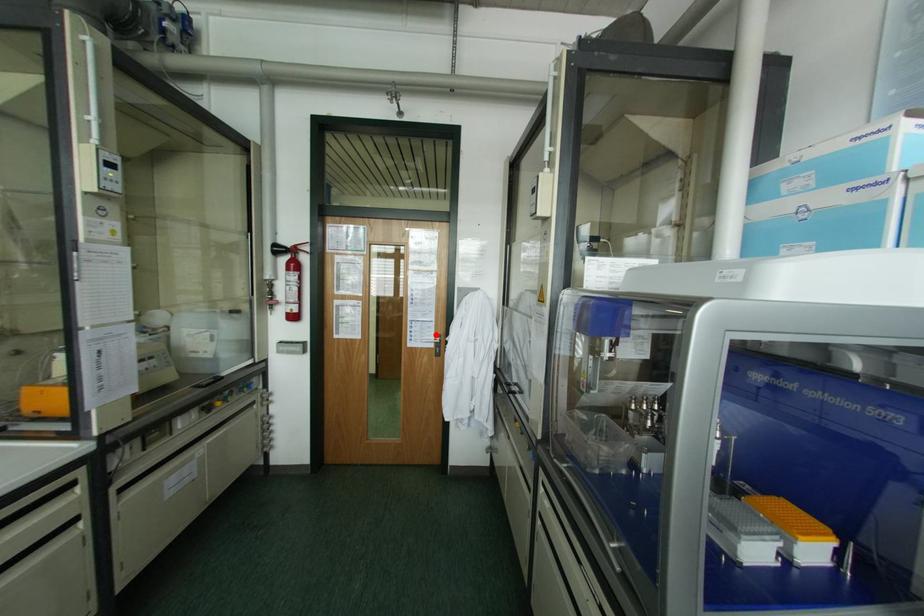
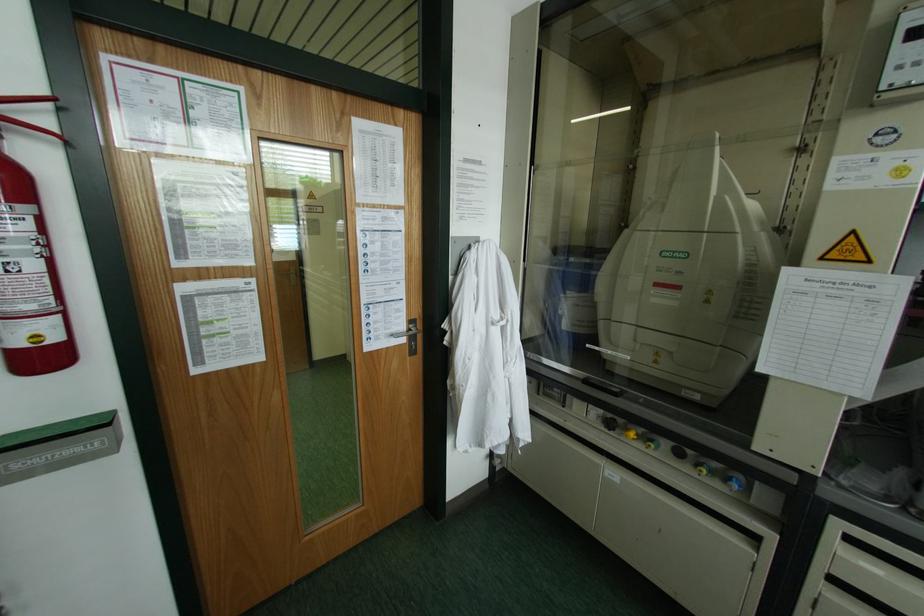
In the second image, find the point that corresponds to the highlighted location in the first image.

(409, 321)